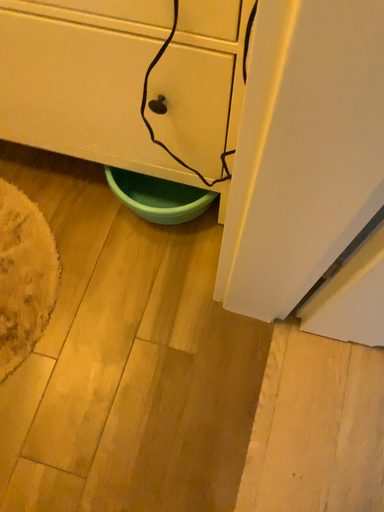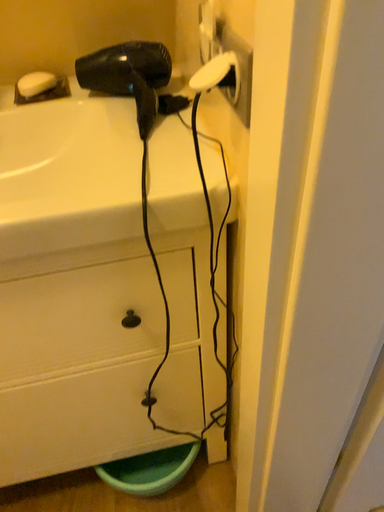
Question: How did the camera likely rotate when shooting the video?

Choices:
 (A) rotated right
 (B) rotated left

Answer: (A)